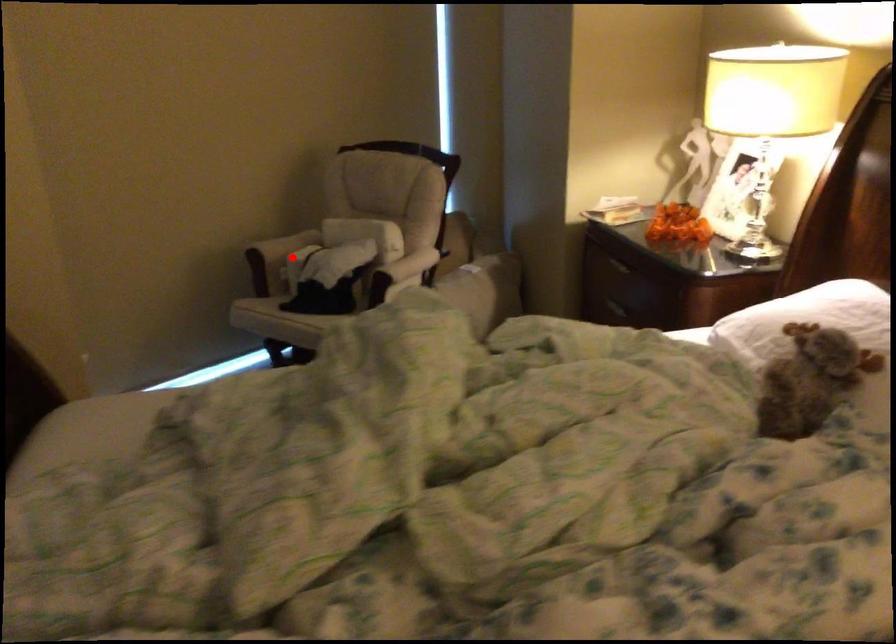
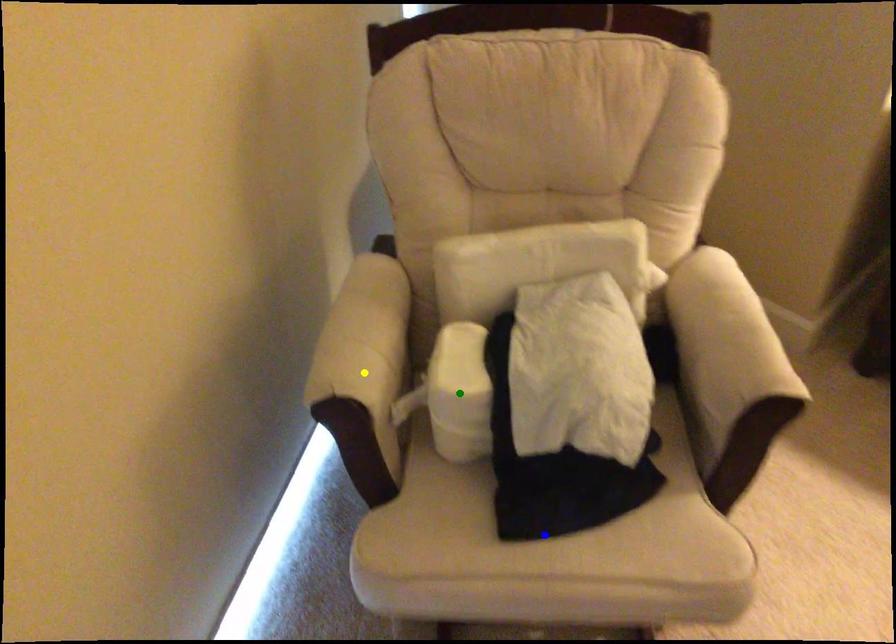
Question: I am providing you with two images of the same scene from different viewpoints. A red point is marked on the first image. You are given multiple points on the second image. Which mark in image 2 goes with the point in image 1?

Choices:
 (A) blue point
 (B) yellow point
 (C) green point

Answer: (C)